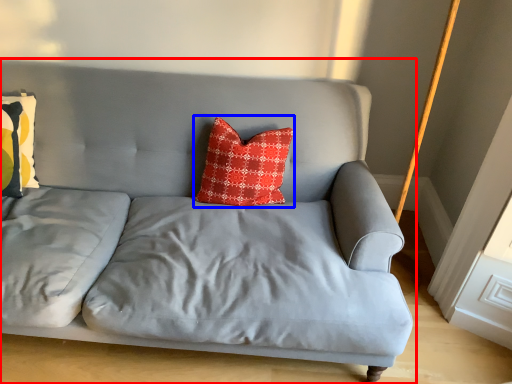
Question: Among these objects, which one is nearest to the camera, studio couch (highlighted by a red box) or pillow (highlighted by a blue box)?

Choices:
 (A) studio couch
 (B) pillow

Answer: (A)